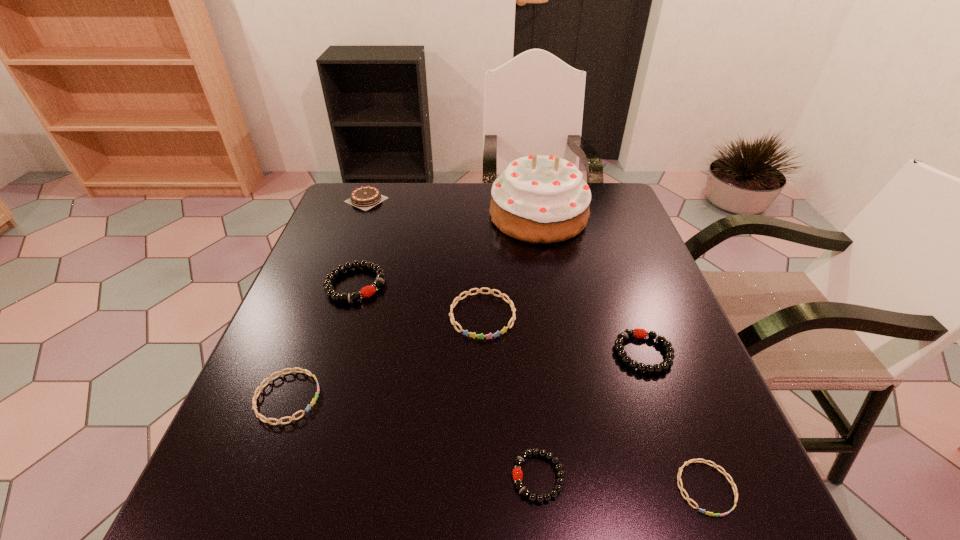
You are a GUI agent. You are given a task and a screenshot of the screen. Output one action in this format:
    pyautogui.click(x=<x>, y=<y>)
    Task: Click on the leftmost blue bracelet
    The width and height of the screenshot is (960, 540).
    Given the screenshot: What is the action you would take?
    pyautogui.click(x=267, y=420)

Identify the location of the second smallest blue bracelet. (267, 420).

Locate an element on the screen. This screenshot has height=540, width=960. the smallest black bracelet is located at coordinates (517, 472).

Locate an element on the screen. the second black bracelet from left to right is located at coordinates (517, 472).

Where is `the rightmost blue bracelet`? the rightmost blue bracelet is located at coordinates (687, 498).

Locate an element on the screen. This screenshot has height=540, width=960. the smallest blue bracelet is located at coordinates (687, 498).

At what (x,y) coordinates should I click in order to perform the action: click on vacant space located 0.060m on the left of the cake. Please return your answer as a coordinate pair (x, y). This screenshot has width=960, height=540. Looking at the image, I should click on (x=468, y=216).

Locate an element on the screen. This screenshot has height=540, width=960. vacant position located on the right of the brown chocolate cake is located at coordinates (485, 200).

Locate an element on the screen. The image size is (960, 540). free location located 0.380m on the front of the biggest black bracelet is located at coordinates [298, 467].

Where is `vacant area situated 0.090m on the surface of the farthest blue bracelet showing star-shaped elements`? The image size is (960, 540). vacant area situated 0.090m on the surface of the farthest blue bracelet showing star-shaped elements is located at coordinates (483, 375).